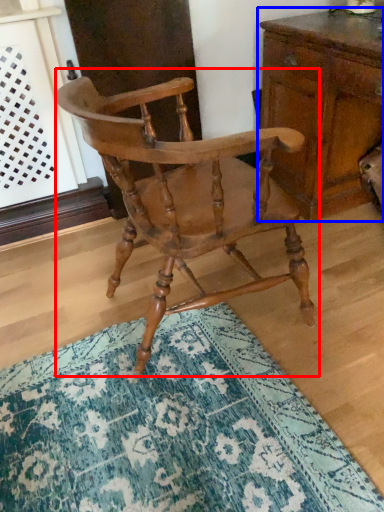
Question: Which object appears farthest to the camera in this image, chair (highlighted by a red box) or chest of drawers (highlighted by a blue box)?

Choices:
 (A) chair
 (B) chest of drawers

Answer: (B)